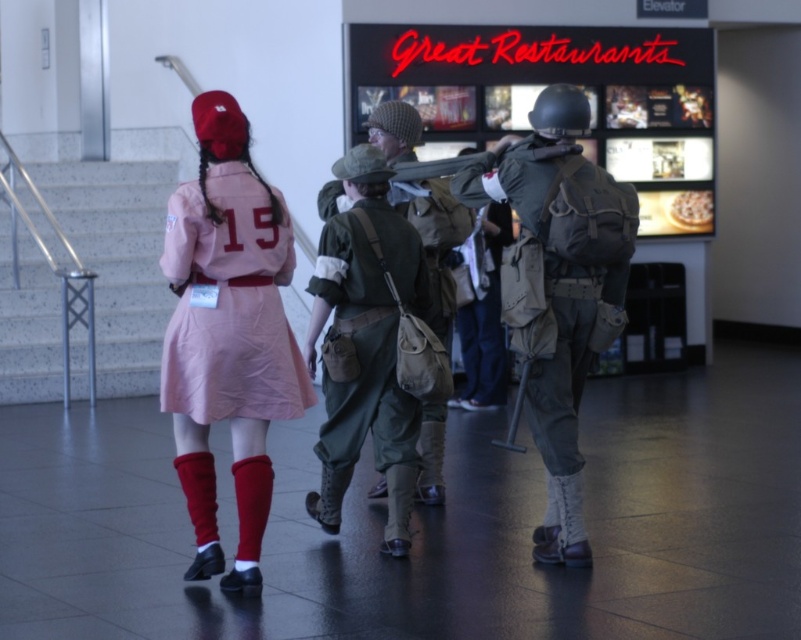
You are standing at the bottom of the staircase with a metallic handrail on the left side. You want to find the pink fabric dress at center. According to the coordinates provided, in which direction should you look relative to the staircase?

The pink fabric dress at center is located at coordinates point (228, 333). Since the staircase is on the left side, you should look towards the center of the scene to find the pink fabric dress at center.

You are a delivery robot with a width of 1 meter. You need to move through the area between the camouflage fabric backpack at center and the green canvas backpack at center. Can you fit through the space between them?

The camouflage fabric backpack at center and green canvas backpack at center are 1.28 meters apart. Since the distance between them is greater than your width of 1 meter, you can safely pass through the space between them.

You are standing at the bottom of the staircase and see the pink fabric dress at center and the green canvas backpack at center. Which object is closer to the staircase handrail?

The pink fabric dress at center is taller than the green canvas backpack at center, but their distance to the staircase handrail cannot be determined based on the given information.